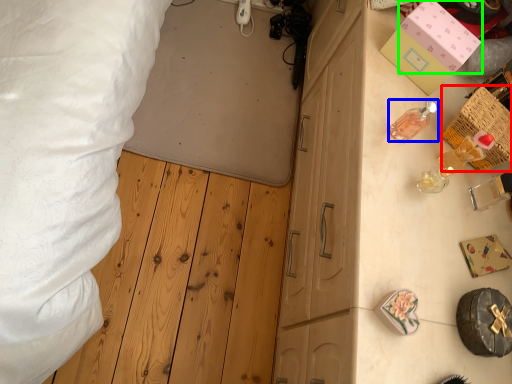
Question: Considering the real-world distances, which object is farthest from crate (highlighted by a red box)? toiletry (highlighted by a blue box) or box (highlighted by a green box)?

Choices:
 (A) toiletry
 (B) box

Answer: (B)